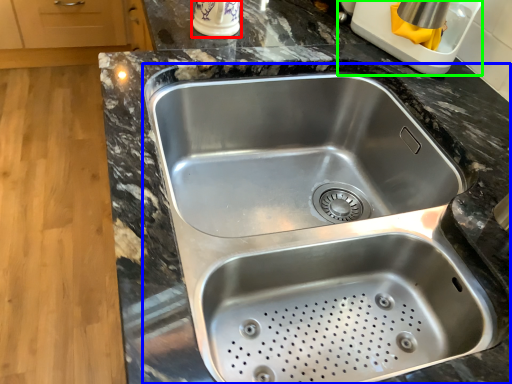
Question: Based on their relative distances, which object is nearer to appliance (highlighted by a red box)? Choose from sink (highlighted by a blue box) and appliance (highlighted by a green box).

Choices:
 (A) sink
 (B) appliance

Answer: (B)